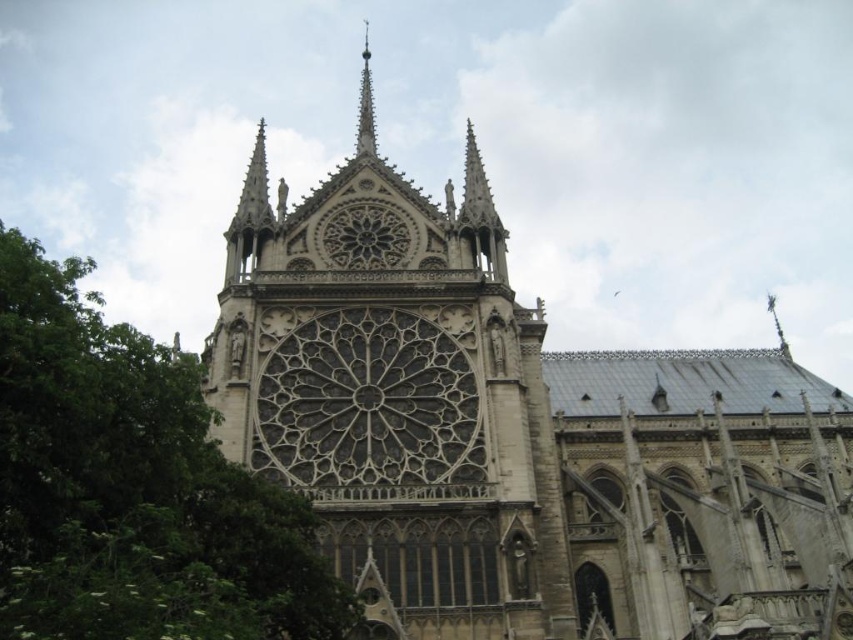
You are standing in front of the cathedral and want to take a photo that includes both the green leafy tree at left and the rose window. Based on their positions, where should you position yourself to capture both in the frame?

To include both the green leafy tree at left and the rose window in your photo, position yourself so that the tree is near the left edge of the frame and the rose window is centered at the top, as the tree is located at the lower left corner of the cathedral facade.

In the scene shown: You are standing in front of the cathedral and see a point marked at coordinates (132,486). What object is located at that point?

The point at coordinates (132,486) is occupied by a green leafy tree at left.

You are standing in front of the cathedral and want to take a photo that includes both the green leafy tree at left and the polished silver spire at upper center. Which object should you position closer to the edge of your camera frame to ensure both are fully visible?

You should position the green leafy tree at left closer to the edge of your camera frame because it is closer to the viewer than the polished silver spire at upper center, allowing both to be captured within the frame.